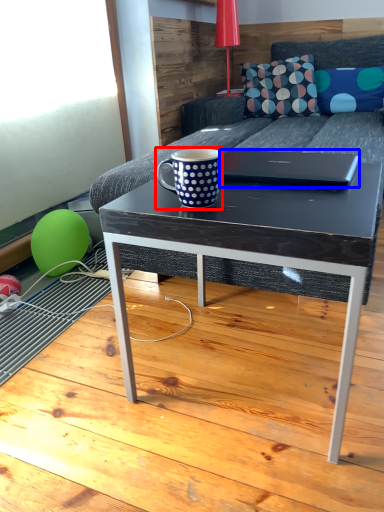
Question: Which of the following is the closest to the observer, coffee cup (highlighted by a red box) or laptop (highlighted by a blue box)?

Choices:
 (A) coffee cup
 (B) laptop

Answer: (A)